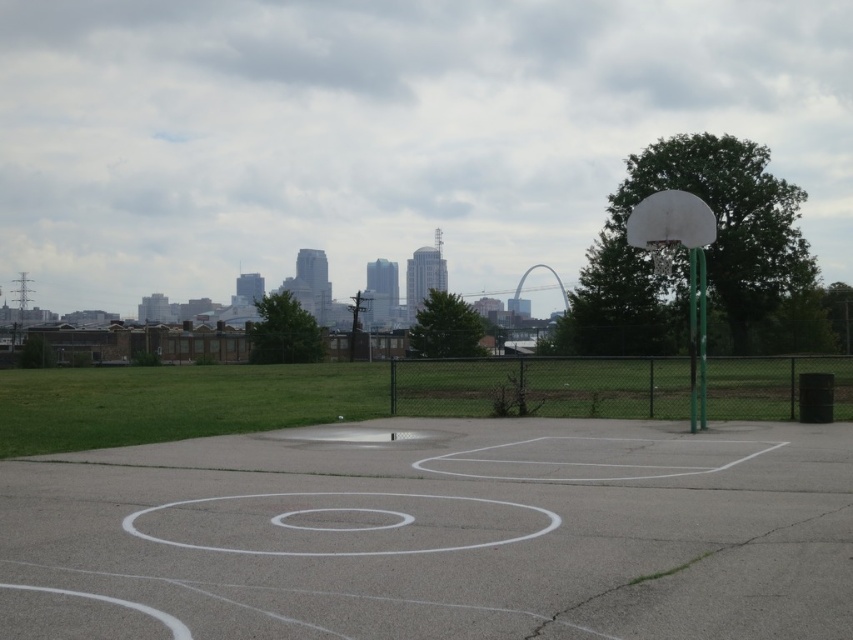
Consider the image. You are a basketball player standing at the edge of the white concrete basketball court at center. You want to shoot a ball into the white matte basketball hoop at right. Based on the court layout, which direction should you face to aim directly at the hoop?

Since the white concrete basketball court at center is to the left of the white matte basketball hoop at right, you should face to the right to aim directly at the hoop.

You are standing at the center of the basketball court and see two points marked on the ground. One is at point (224,531) and the other is at point (688,257). Which point is closer to you?

Point (224,531) is in front of point (688,257), so the point at (224,531) is closer to you.

You are a basketball player standing at the free throw line on the white concrete basketball court at center. You want to pass the ball to your teammate who is standing 5 meters away from you. Is your teammate within the court boundaries?

The distance between you and your teammate is 5 meters, which is less than the 5.41 meters between the objects, so the teammate is within the court boundaries.